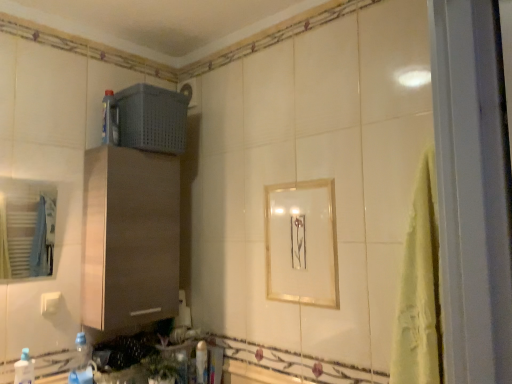
In order to face translucent plastic bottle at upper left, placed as the 2th bottle when sorted from right to left, should I rotate leftwards or rightwards?

A 18.807 degree turn to the left will do.

Describe the element at coordinates (26, 228) in the screenshot. The width and height of the screenshot is (512, 384). I see `matte white towel rack at left` at that location.

Image resolution: width=512 pixels, height=384 pixels. Find the location of `translucent plastic bottle at lower left, the 1th bottle in the left-to-right sequence`. translucent plastic bottle at lower left, the 1th bottle in the left-to-right sequence is located at coordinates (24, 369).

What do you see at coordinates (255, 374) in the screenshot? Image resolution: width=512 pixels, height=384 pixels. I see `white glossy bath at lower center` at bounding box center [255, 374].

Where is `white plastic electric outlet at lower left`? white plastic electric outlet at lower left is located at coordinates (50, 302).

Is matte white towel rack at left behind translucent plastic bottle at upper left, acting as the first bottle starting from the top?

No, the depth of matte white towel rack at left is less than that of translucent plastic bottle at upper left, acting as the first bottle starting from the top.

Between matte white towel rack at left and translucent plastic bottle at upper left, arranged as the third bottle when viewed from the left, which one has smaller width?

matte white towel rack at left is thinner.

Is white plastic electric outlet at lower left inside or outside of white glossy bottle at lower center, which ranks as the first bottle in back-to-front order?

white plastic electric outlet at lower left exists outside the volume of white glossy bottle at lower center, which ranks as the first bottle in back-to-front order.

Based on their sizes in the image, would you say white plastic electric outlet at lower left is bigger or smaller than white glossy bottle at lower center, positioned as the first bottle in right-to-left order?

white plastic electric outlet at lower left is smaller than white glossy bottle at lower center, positioned as the first bottle in right-to-left order.

Is white plastic electric outlet at lower left positioned far away from white glossy bottle at lower center, the 4th bottle when ordered from left to right?

That's not correct — white plastic electric outlet at lower left is a little close to white glossy bottle at lower center, the 4th bottle when ordered from left to right.

In the scene shown: Can you tell me how much white plastic electric outlet at lower left and white glossy bottle at lower center, which ranks as the first bottle in back-to-front order, differ in facing direction?

The facing directions of white plastic electric outlet at lower left and white glossy bottle at lower center, which ranks as the first bottle in back-to-front order, are 0.0156 degrees apart.

Considering the sizes of objects white plastic electric outlet at lower left and gold metallic picture frame at center in the image provided, who is thinner, white plastic electric outlet at lower left or gold metallic picture frame at center?

Thinner between the two is gold metallic picture frame at center.

Which object is more forward, white plastic electric outlet at lower left or gold metallic picture frame at center?

gold metallic picture frame at center is more forward.

Is white plastic electric outlet at lower left spatially inside gold metallic picture frame at center, or outside of it?

white plastic electric outlet at lower left is located beyond the bounds of gold metallic picture frame at center.

Is white plastic electric outlet at lower left taller or shorter than gold metallic picture frame at center?

Clearly, white plastic electric outlet at lower left is shorter compared to gold metallic picture frame at center.

Considering the points (58, 293) and (83, 353), which point is in front, point (58, 293) or point (83, 353)?

The point (58, 293) is more forward.

Considering the sizes of white plastic electric outlet at lower left and blue plastic bottle at lower left, the 2th bottle in the left-to-right sequence, in the image, is white plastic electric outlet at lower left wider or thinner than blue plastic bottle at lower left, the 2th bottle in the left-to-right sequence,?

white plastic electric outlet at lower left is thinner than blue plastic bottle at lower left, the 2th bottle in the left-to-right sequence.

Would you say white plastic electric outlet at lower left is to the left or to the right of blue plastic bottle at lower left, which is the 3th bottle in right-to-left order, in the picture?

white plastic electric outlet at lower left is positioned on blue plastic bottle at lower left, which is the 3th bottle in right-to-left order,'s left side.

In the scene shown: Is the depth of white plastic electric outlet at lower left greater than that of blue plastic bottle at lower left, which appears as the third bottle when viewed from the back?

Yes, the depth of white plastic electric outlet at lower left is greater than that of blue plastic bottle at lower left, which appears as the third bottle when viewed from the back.

Is white glossy bottle at lower center, positioned as the first bottle in right-to-left order, shorter than white plastic electric outlet at lower left?

No.

The width and height of the screenshot is (512, 384). Find the location of `electric outlet above the white glossy bottle at lower center, which is the first bottle in bottom-to-top order (from a real-world perspective)`. electric outlet above the white glossy bottle at lower center, which is the first bottle in bottom-to-top order (from a real-world perspective) is located at coordinates tap(50, 302).

Which is behind, white glossy bottle at lower center, which is the first bottle in bottom-to-top order, or white plastic electric outlet at lower left?

white glossy bottle at lower center, which is the first bottle in bottom-to-top order, is further away from the camera.

From the image's perspective, does white glossy bottle at lower center, which ranks as the first bottle in back-to-front order, appear higher than white plastic electric outlet at lower left?

No, from the image's perspective, white glossy bottle at lower center, which ranks as the first bottle in back-to-front order, is not above white plastic electric outlet at lower left.

Which is closer to the camera, (115, 131) or (41, 219)?

The point (115, 131) is more forward.

Is translucent plastic bottle at upper left, arranged as the third bottle when viewed from the left, facing towards matte white towel rack at left?

No, translucent plastic bottle at upper left, arranged as the third bottle when viewed from the left, is not facing towards matte white towel rack at left.

Considering the relative positions of translucent plastic bottle at upper left, arranged as the third bottle when viewed from the left, and matte white towel rack at left in the image provided, is translucent plastic bottle at upper left, arranged as the third bottle when viewed from the left, to the left of matte white towel rack at left from the viewer's perspective?

In fact, translucent plastic bottle at upper left, arranged as the third bottle when viewed from the left, is to the right of matte white towel rack at left.

Are translucent plastic bottle at upper left, acting as the fourth bottle starting from the bottom, and matte white towel rack at left located far from each other?

Yes, translucent plastic bottle at upper left, acting as the fourth bottle starting from the bottom, and matte white towel rack at left are quite far apart.

From the image's perspective, who appears lower, brushed wood cabinet at center or translucent plastic bottle at upper left, acting as the first bottle starting from the top?

brushed wood cabinet at center, from the image's perspective.

Considering the positions of objects brushed wood cabinet at center and translucent plastic bottle at upper left, acting as the first bottle starting from the top, in the image provided, who is more to the left, brushed wood cabinet at center or translucent plastic bottle at upper left, acting as the first bottle starting from the top,?

From the viewer's perspective, translucent plastic bottle at upper left, acting as the first bottle starting from the top, appears more on the left side.

Could you tell me if brushed wood cabinet at center is facing translucent plastic bottle at upper left, which is the third bottle in front-to-back order?

No, brushed wood cabinet at center is not facing towards translucent plastic bottle at upper left, which is the third bottle in front-to-back order.

Can you tell me how much brushed wood cabinet at center and translucent plastic bottle at upper left, acting as the fourth bottle starting from the bottom, differ in facing direction?

The facing directions of brushed wood cabinet at center and translucent plastic bottle at upper left, acting as the fourth bottle starting from the bottom, are 0.00173 degrees apart.

The width and height of the screenshot is (512, 384). I want to click on mirror that is below the translucent plastic bottle at upper left, acting as the first bottle starting from the top (from the image's perspective), so click(26, 228).

Identify the location of electric outlet above the white glossy bottle at lower center, acting as the fourth bottle starting from the front (from a real-world perspective). (50, 302).

Consider the image. Considering their positions, is translucent plastic bottle at upper left, arranged as the third bottle when viewed from the left, positioned closer to gray plastic basket at upper center than blue plastic bottle at lower left, the 2th bottle in the bottom-to-top sequence?

translucent plastic bottle at upper left, arranged as the third bottle when viewed from the left, is positioned closer to the anchor gray plastic basket at upper center.

Estimate the real-world distances between objects in this image. Which object is closer to brushed wood cabinet at center, white glossy bottle at lower center, the fourth bottle when ordered from top to bottom, or gold metallic picture frame at center?

white glossy bottle at lower center, the fourth bottle when ordered from top to bottom.

When comparing their distances from translucent plastic bottle at lower left, the 1th bottle in the left-to-right sequence, does matte white towel rack at left or brushed wood cabinet at center seem further?

Among the two, matte white towel rack at left is located further to translucent plastic bottle at lower left, the 1th bottle in the left-to-right sequence.

Based on their spatial positions, is blue plastic bottle at lower left, placed as the 2th bottle when sorted from front to back, or matte white towel rack at left further from gold metallic picture frame at center?

matte white towel rack at left lies further to gold metallic picture frame at center than the other object.

Which object lies nearer to the anchor point brushed wood cabinet at center, white glossy bath at lower center or gold metallic picture frame at center?

gold metallic picture frame at center is closer to brushed wood cabinet at center.

Estimate the real-world distances between objects in this image. Which object is closer to gray plastic basket at upper center, gold metallic picture frame at center or translucent plastic bottle at lower left, the 3th bottle positioned from the bottom?

gold metallic picture frame at center is positioned closer to the anchor gray plastic basket at upper center.

When comparing their distances from brushed wood cabinet at center, does white glossy bottle at lower center, the 4th bottle when ordered from left to right, or gray plastic basket at upper center seem closer?

gray plastic basket at upper center is positioned closer to the anchor brushed wood cabinet at center.

Consider the image. Based on their spatial positions, is brushed wood cabinet at center or white glossy bottle at lower center, which ranks as the first bottle in back-to-front order, closer to white glossy bath at lower center?

white glossy bottle at lower center, which ranks as the first bottle in back-to-front order, is positioned closer to the anchor white glossy bath at lower center.

Where is `cabinetry between white plastic electric outlet at lower left and white glossy bottle at lower center, the 4th bottle when ordered from left to right, from left to right`? The height and width of the screenshot is (384, 512). cabinetry between white plastic electric outlet at lower left and white glossy bottle at lower center, the 4th bottle when ordered from left to right, from left to right is located at coordinates (130, 237).

In order to click on bath between translucent plastic bottle at lower left, positioned as the 2th bottle in top-to-bottom order, and gold metallic picture frame at center, in the horizontal direction in this screenshot , I will do `click(255, 374)`.

Find the location of `cabinetry between gray plastic basket at upper center and blue plastic bottle at lower left, the 2th bottle in the bottom-to-top sequence, in the vertical direction`. cabinetry between gray plastic basket at upper center and blue plastic bottle at lower left, the 2th bottle in the bottom-to-top sequence, in the vertical direction is located at coordinates (130, 237).

The image size is (512, 384). Find the location of `electric outlet between brushed wood cabinet at center and translucent plastic bottle at lower left, the 1th bottle in the left-to-right sequence, from top to bottom`. electric outlet between brushed wood cabinet at center and translucent plastic bottle at lower left, the 1th bottle in the left-to-right sequence, from top to bottom is located at coordinates (50, 302).